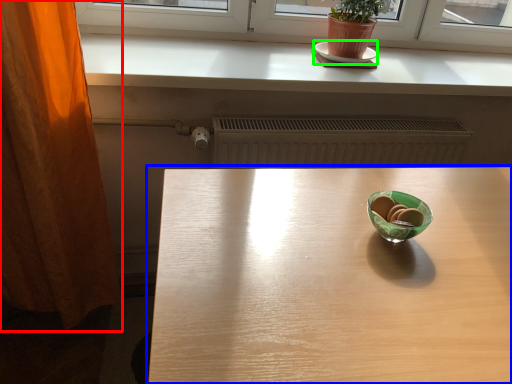
Question: Estimate the real-world distances between objects in this image. Which object is closer to curtain (highlighted by a red box), table (highlighted by a blue box) or plate (highlighted by a green box)?

Choices:
 (A) table
 (B) plate

Answer: (A)